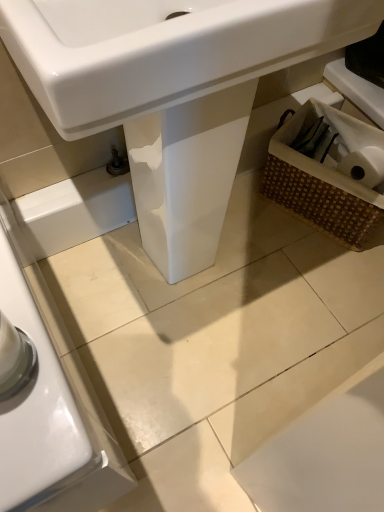
Image resolution: width=384 pixels, height=512 pixels. Find the location of `vacant space in front of white glossy sink at center`. vacant space in front of white glossy sink at center is located at coordinates (183, 380).